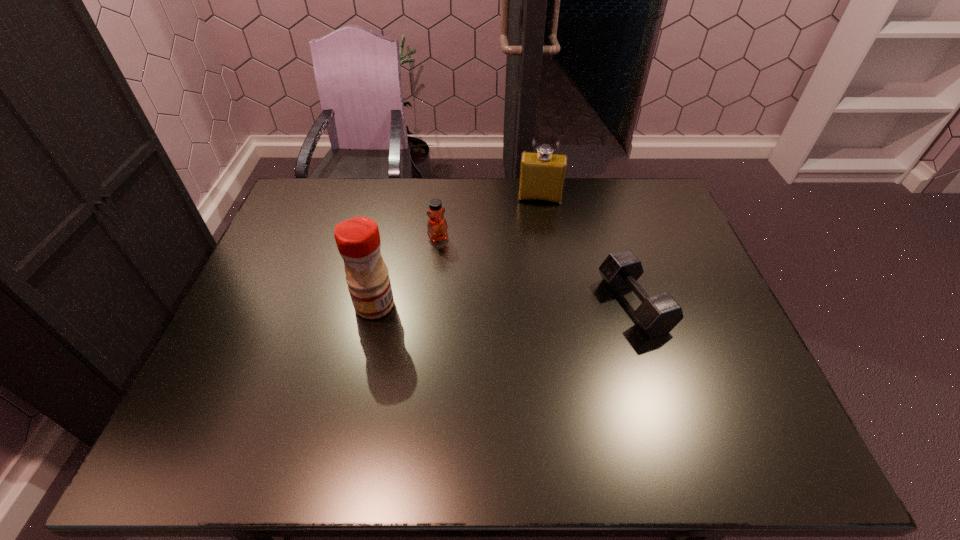
The image size is (960, 540). In order to click on free spot on the desktop that is between the tallest object and the rightmost object and is positioned on the front-facing side of the perfume in this screenshot , I will do `click(532, 305)`.

This screenshot has height=540, width=960. Identify the location of vacant space on the desktop that is between the tallest object and the shortest object and is positioned on the front label of the second farthest object. (468, 305).